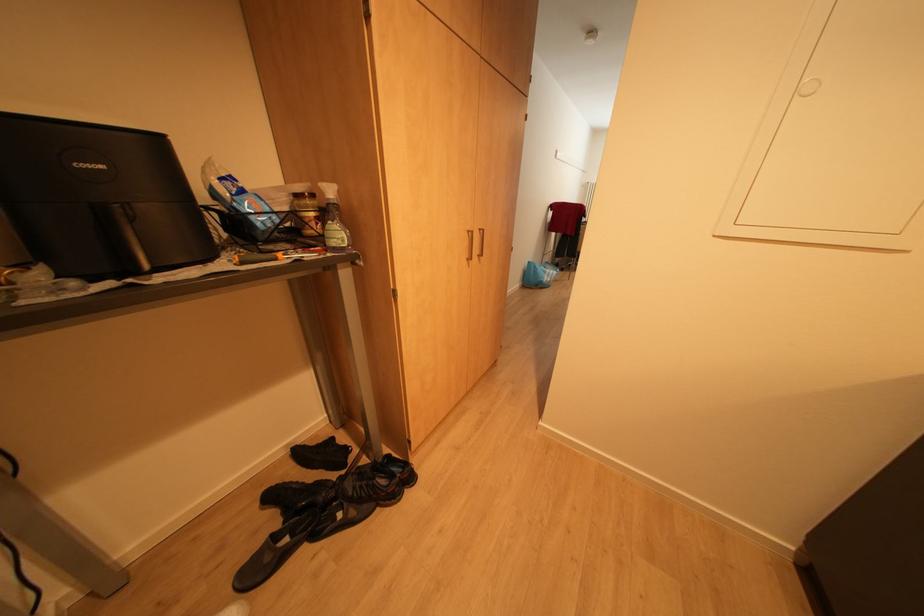
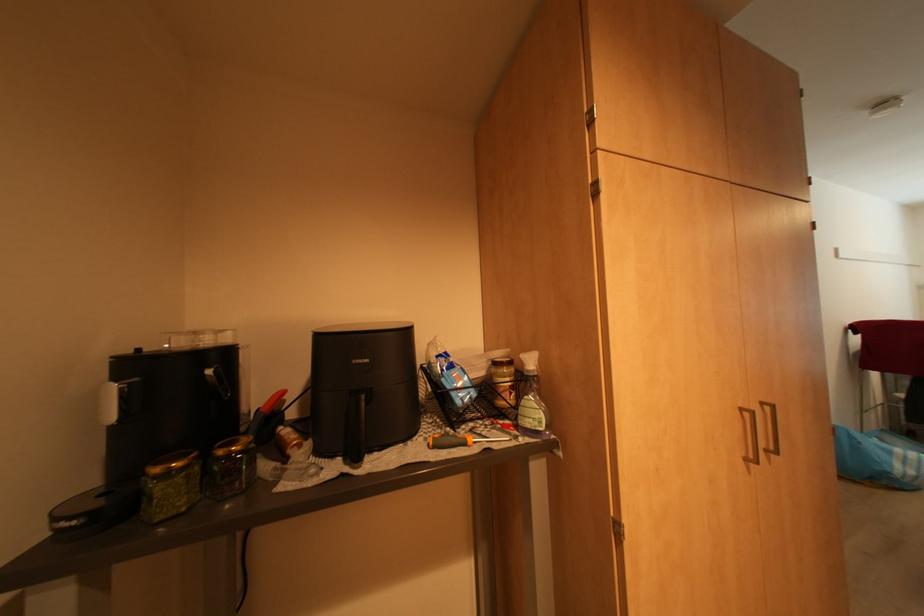
The first image is from the beginning of the video and the second image is from the end. How did the camera likely rotate when shooting the video?

The camera rotated toward left-up.